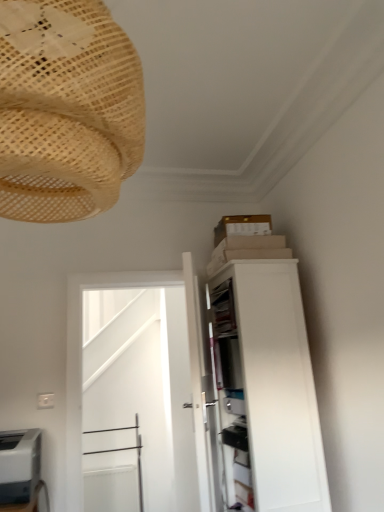
Question: Does white glossy door at center have a lesser width compared to natural woven lampshade at upper left?

Choices:
 (A) no
 (B) yes

Answer: (B)

Question: From a real-world perspective, is white glossy door at center below natural woven lampshade at upper left?

Choices:
 (A) no
 (B) yes

Answer: (B)

Question: Does white glossy door at center contain natural woven lampshade at upper left?

Choices:
 (A) yes
 (B) no

Answer: (B)

Question: From a real-world perspective, does white glossy door at center stand above natural woven lampshade at upper left?

Choices:
 (A) no
 (B) yes

Answer: (A)

Question: From the image's perspective, is white glossy door at center located above natural woven lampshade at upper left?

Choices:
 (A) no
 (B) yes

Answer: (A)

Question: Looking at the image, does white glossy door at center seem bigger or smaller compared to gray matte printer at lower left?

Choices:
 (A) big
 (B) small

Answer: (A)

Question: In terms of width, does white glossy door at center look wider or thinner when compared to gray matte printer at lower left?

Choices:
 (A) thin
 (B) wide

Answer: (A)

Question: From a real-world perspective, relative to gray matte printer at lower left, is white glossy door at center vertically above or below?

Choices:
 (A) below
 (B) above

Answer: (B)

Question: In the image, is white glossy door at center positioned in front of or behind gray matte printer at lower left?

Choices:
 (A) front
 (B) behind

Answer: (B)

Question: In the image, is white matte cabinet at upper right on the left side or the right side of natural woven lampshade at upper left?

Choices:
 (A) right
 (B) left

Answer: (A)

Question: From a real-world perspective, relative to natural woven lampshade at upper left, is white matte cabinet at upper right vertically above or below?

Choices:
 (A) below
 (B) above

Answer: (A)

Question: Does point (301, 373) appear closer or farther from the camera than point (18, 96)?

Choices:
 (A) farther
 (B) closer

Answer: (A)

Question: Based on their sizes in the image, would you say white matte cabinet at upper right is bigger or smaller than natural woven lampshade at upper left?

Choices:
 (A) small
 (B) big

Answer: (B)

Question: From the image's perspective, relative to white matte cabinet at upper right, is gray matte printer at lower left above or below?

Choices:
 (A) below
 (B) above

Answer: (A)

Question: From their relative heights in the image, would you say gray matte printer at lower left is taller or shorter than white matte cabinet at upper right?

Choices:
 (A) tall
 (B) short

Answer: (B)